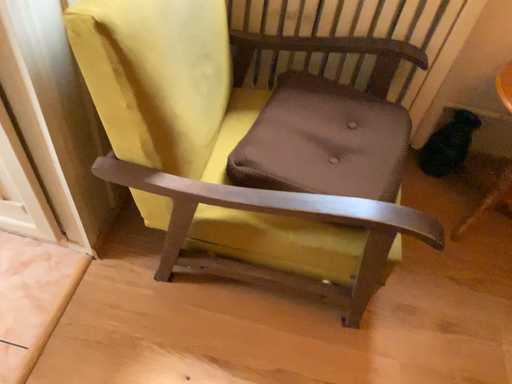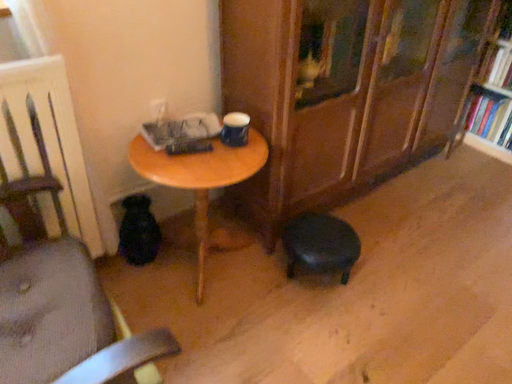
Question: How did the camera likely rotate when shooting the video?

Choices:
 (A) rotated left
 (B) rotated right

Answer: (B)